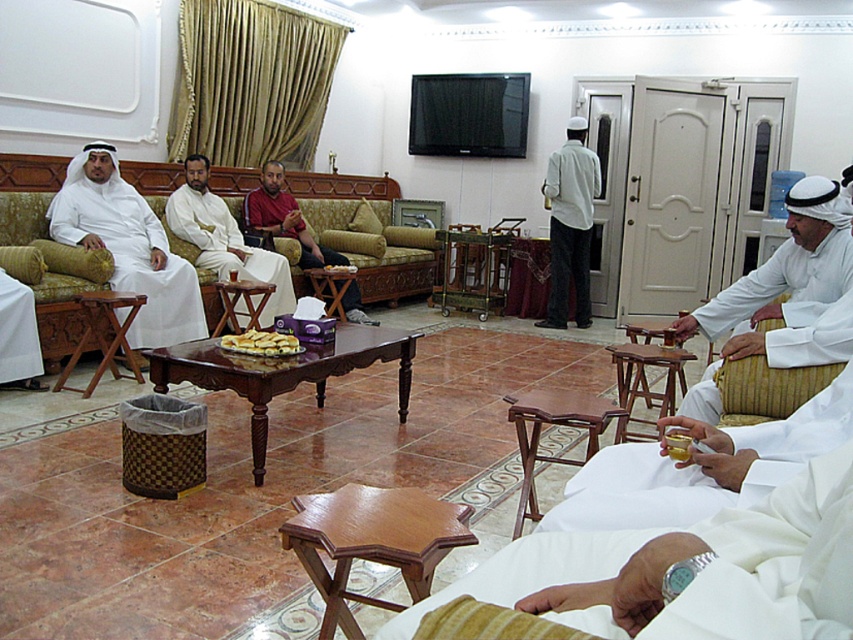
Question: Estimate the real-world distances between objects in this image. Which object is farther from the wooden stool at center?

Choices:
 (A) matte white robe at center
 (B) light gray cotton shirt at center
 (C) wooden table at center

Answer: (B)

Question: Can you confirm if wooden couch at center is positioned above wooden folding stool at center?

Choices:
 (A) no
 (B) yes

Answer: (B)

Question: Is white matte robe at lower right smaller than mahogany wood coffee table at center?

Choices:
 (A) yes
 (B) no

Answer: (A)

Question: Which object is farther from the camera taking this photo?

Choices:
 (A) wooden folding table at lower center
 (B) matte red shirt at center
 (C) white woven drum at right

Answer: (B)

Question: Is wooden couch at center smaller than wooden stool at center?

Choices:
 (A) no
 (B) yes

Answer: (A)

Question: Considering the real-world distances, which object is closest to the mahogany wood side table at lower center?

Choices:
 (A) matte white robe at center
 (B) wooden table at center

Answer: (B)